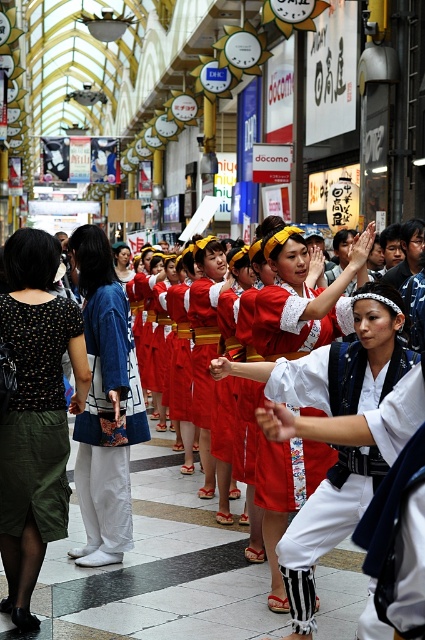
You are a photographer positioned in front of the performers. You notice two items of clothing at the center of the scene. Which one is positioned to the left when looking at the polka dot blouse at center and the white cotton kimono at center?

The polka dot blouse at center is positioned to the left of the white cotton kimono at center.

You are a photographer standing in the shopping arcade and want to capture both the polka dot blouse at center and the blue cotton kimono at left in a single photo. Which object should you focus on first to ensure both are in frame?

You should focus on the polka dot blouse at center first because it is much taller than the blue cotton kimono at left, so adjusting the camera angle to include its height will naturally include the shorter blue cotton kimono at left as well.